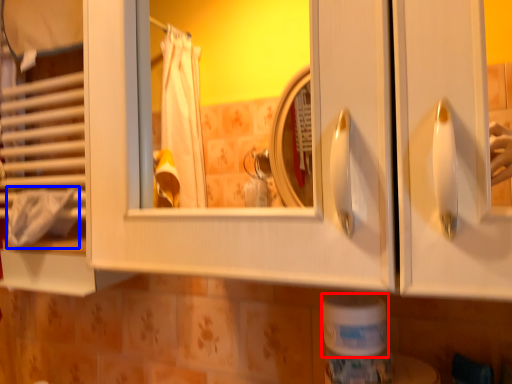
Question: Which object appears closest to the camera in this image, toilet paper (highlighted by a red box) or bath towel (highlighted by a blue box)?

Choices:
 (A) toilet paper
 (B) bath towel

Answer: (A)